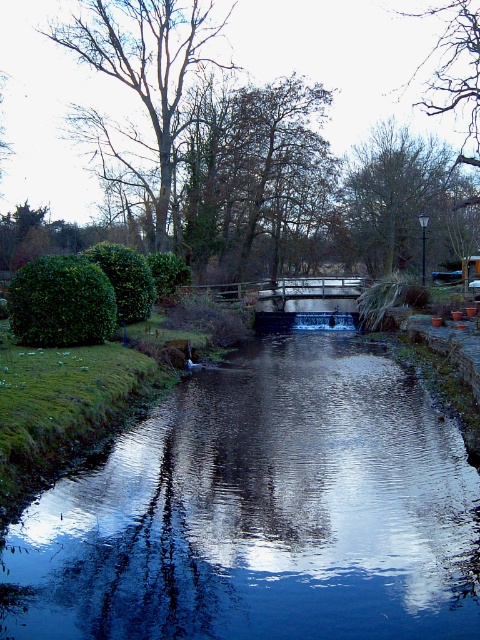
Between smooth dark blue water at center and green leafy tree at center, which one has more height?

green leafy tree at center

Is smooth dark blue water at center smaller than green leafy tree at center?

Yes.

Does point (141, 520) come closer to viewer compared to point (264, 99)?

Yes, it is in front of point (264, 99).

Where is `smooth dark blue water at center`? smooth dark blue water at center is located at coordinates tap(262, 512).

Does smooth dark blue water at center appear on the left side of smooth bark tree at upper left?

Incorrect, smooth dark blue water at center is not on the left side of smooth bark tree at upper left.

Where is `smooth dark blue water at center`? The image size is (480, 640). smooth dark blue water at center is located at coordinates (262, 512).

What are the coordinates of `smooth dark blue water at center` in the screenshot? It's located at (262, 512).

Is green leafy tree at center above smooth bark tree at upper left?

Actually, green leafy tree at center is below smooth bark tree at upper left.

Between point (228, 205) and point (168, 104), which one is positioned behind?

The point (228, 205) is behind.

Which is behind, point (280, 92) or point (154, 56)?

The point (280, 92) is behind.

Image resolution: width=480 pixels, height=640 pixels. In order to click on green leafy tree at center in this screenshot , I will do `click(254, 173)`.